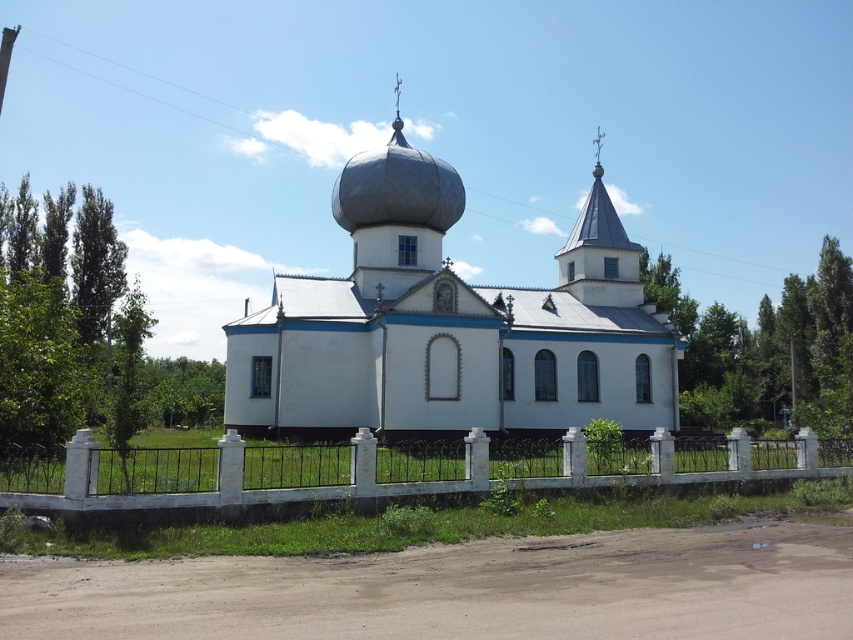
You are standing in front of the white smooth church at center and the white concrete fence at lower center. Which one appears taller from your perspective?

The white smooth church at center is much taller than the white concrete fence at lower center, so it appears taller from your perspective.

You are standing in front of the church and want to locate the point at coordinates point (450, 324). Based on the description, where exactly is this point located on the church?

The point (450, 324) is located on the white smooth church at center.